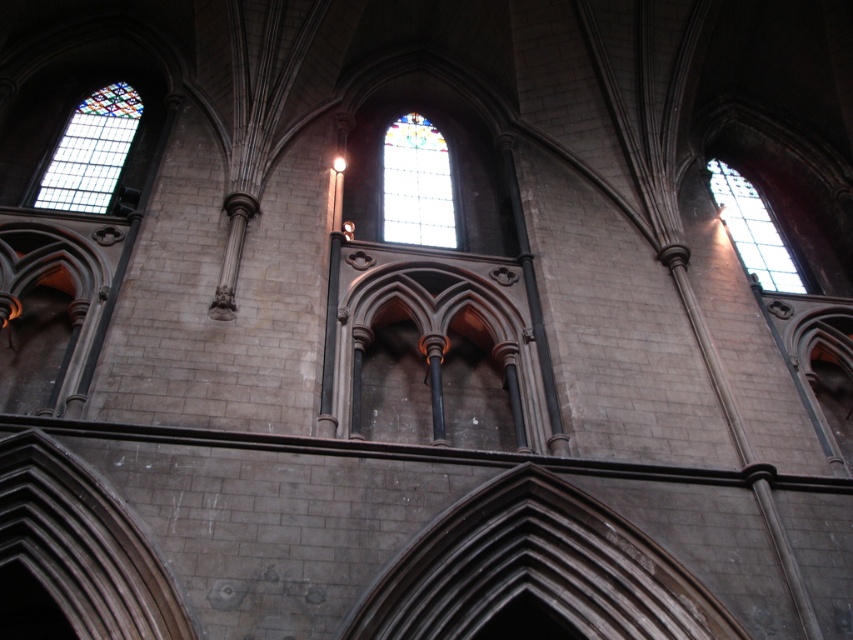
You are an architect analyzing the stained glass windows in the Gothic cathedral. You observe the stained glass window at upper left and the stained glass window at center. Which of these two windows is shorter in height?

The stained glass window at upper left is shorter in height compared to the stained glass window at center because it is not as tall as the center window.

You are an architect designing a new Gothic cathedral and want to ensure the stained glass windows are spaced appropriately. Given that the distance between the stained glass window at upper left and the stained glass window at upper right is 55.19 meters, what is the minimum width your cathedral nave should be to accommodate this spacing?

The minimum width your cathedral nave should be is at least 55.19 meters to accommodate the 55.19 meters distance between the stained glass window at upper left and the stained glass window at upper right.

You are an architect analyzing the Gothic building. You notice the stained glass window at center and the stained glass window at upper right. Which one is positioned higher in the structure?

The stained glass window at center is positioned higher in the structure than the stained glass window at upper right.